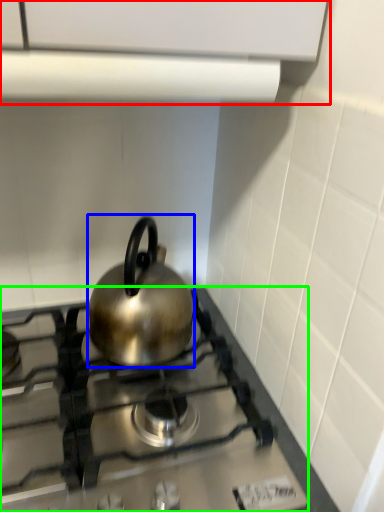
Question: Considering the real-world distances, which object is closest to vent (highlighted by a red box)? kettle (highlighted by a blue box) or gas stove (highlighted by a green box).

Choices:
 (A) kettle
 (B) gas stove

Answer: (A)